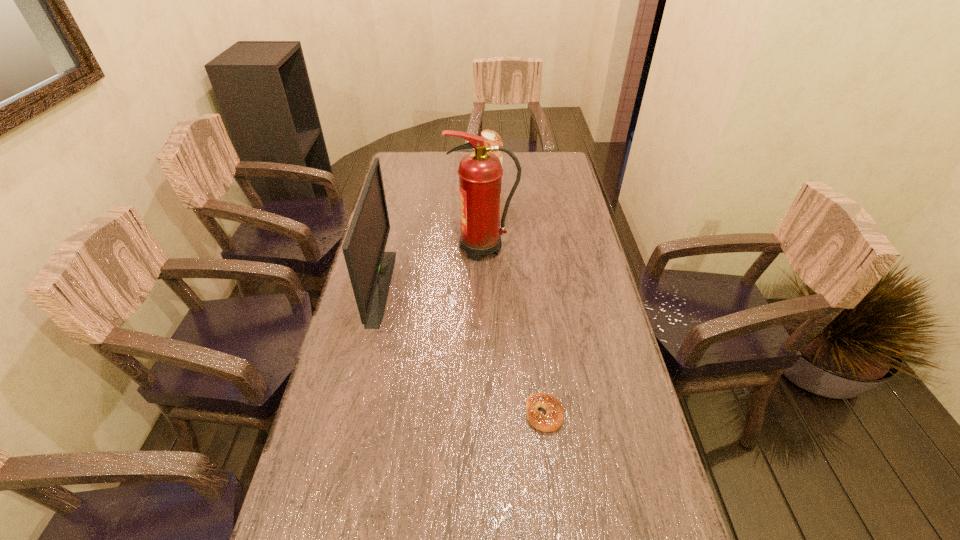
In order to click on vacant space that's between the bagel and the monitor in this screenshot , I will do click(x=463, y=350).

This screenshot has height=540, width=960. In order to click on vacant area that lies between the fire extinguisher and the leftmost object in this screenshot , I will do `click(432, 267)`.

You are a GUI agent. You are given a task and a screenshot of the screen. Output one action in this format:
    pyautogui.click(x=<x>, y=<y>)
    Task: Click on the free spot between the third shortest object and the nearest object
    Image resolution: width=960 pixels, height=540 pixels.
    Given the screenshot: What is the action you would take?
    pos(463,350)

Identify the location of vacant space in between the monitor and the farthest object. (436, 241).

This screenshot has width=960, height=540. I want to click on vacant region between the farthest object and the third shortest object, so click(x=436, y=241).

The height and width of the screenshot is (540, 960). In order to click on empty space between the burrito and the shortest object in this screenshot , I will do point(518,304).

In order to click on object that is the third closest to the leftmost object in this screenshot , I will do `click(553, 419)`.

Identify which object is located as the third nearest to the third tallest object. Please provide its 2D coordinates. Your answer should be formatted as a tuple, i.e. [(x, y)], where the tuple contains the x and y coordinates of a point satisfying the conditions above.

[(553, 419)]

In order to click on blank space that satisfies the following two spatial constraints: 1. on the front-facing side of the second tallest object; 2. on the back side of the nearest object in this screenshot , I will do `click(351, 414)`.

Where is `vacant position in the image that satisfies the following two spatial constraints: 1. on the front-facing side of the tallest object; 2. on the left side of the shortest object`? Image resolution: width=960 pixels, height=540 pixels. vacant position in the image that satisfies the following two spatial constraints: 1. on the front-facing side of the tallest object; 2. on the left side of the shortest object is located at coordinates (484, 414).